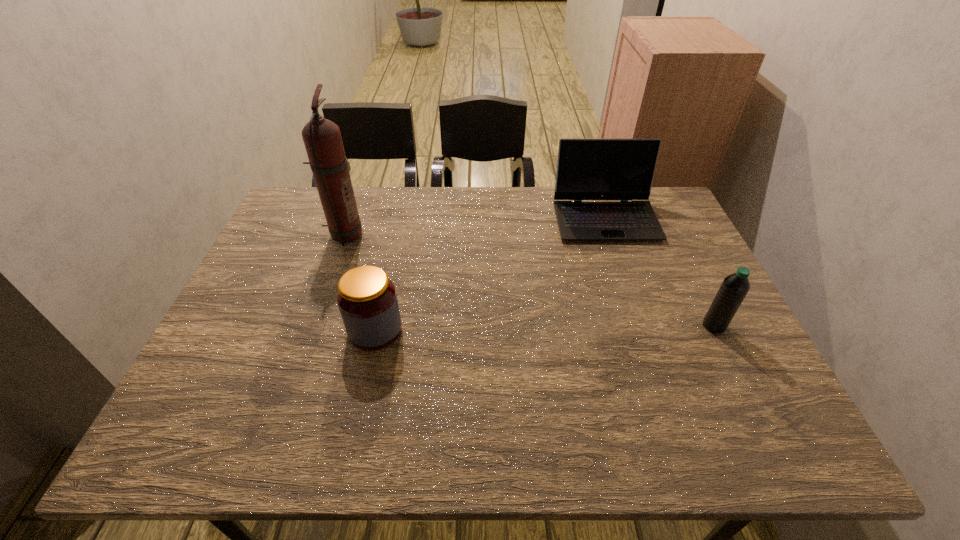
The width and height of the screenshot is (960, 540). In the image, there is a desktop. What are the coordinates of `free region at the far right corner` in the screenshot? It's located at (654, 204).

Find the location of a particular element. This screenshot has height=540, width=960. vacant space at the near right corner is located at coordinates (782, 453).

Find the location of a particular element. free space between the third object from right to left and the laptop computer is located at coordinates (491, 274).

The height and width of the screenshot is (540, 960). Identify the location of unoccupied position between the water bottle and the leftmost object. (529, 280).

Find the location of a particular element. The height and width of the screenshot is (540, 960). blank region between the water bottle and the jar is located at coordinates (544, 328).

Identify the location of blank region between the third object from right to left and the water bottle. Image resolution: width=960 pixels, height=540 pixels. (544, 328).

At what (x,y) coordinates should I click in order to perform the action: click on vacant space that's between the fire extinguisher and the laptop computer. Please return your answer as a coordinate pair (x, y). Looking at the image, I should click on (474, 227).

What are the coordinates of `free space between the laptop computer and the third object from right to left` in the screenshot? It's located at (491, 274).

Locate an element on the screen. This screenshot has width=960, height=540. empty space between the water bottle and the fire extinguisher is located at coordinates (529, 280).

You are a GUI agent. You are given a task and a screenshot of the screen. Output one action in this format:
    pyautogui.click(x=<x>, y=<y>)
    Task: Click on the free space that is in between the laptop computer and the third object from right to left
    The height and width of the screenshot is (540, 960).
    Given the screenshot: What is the action you would take?
    pyautogui.click(x=491, y=274)